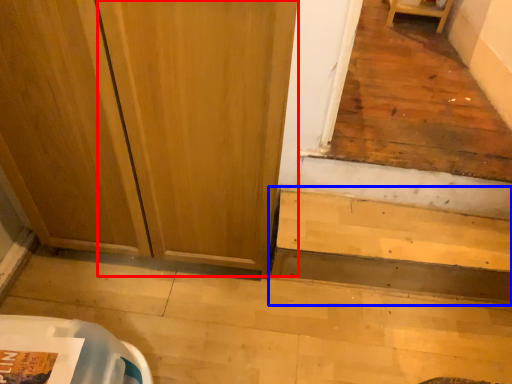
Question: Which object is closer to the camera taking this photo, screen door (highlighted by a red box) or stairwell (highlighted by a blue box)?

Choices:
 (A) screen door
 (B) stairwell

Answer: (A)